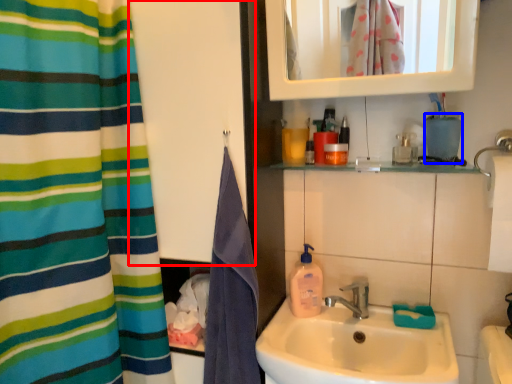
Question: Among these objects, which one is nearest to the camera, screen door (highlighted by a red box) or teal (highlighted by a blue box)?

Choices:
 (A) screen door
 (B) teal

Answer: (A)